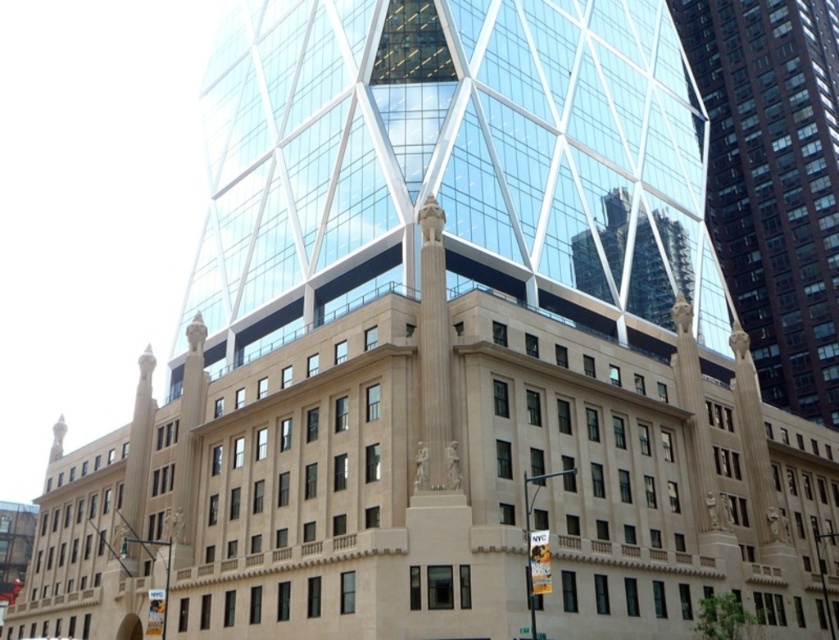
Looking at this image, you are a photographer trying to capture both the brown glass building at center and the metallic silver car at center in a single frame. Based on their sizes, which object should appear larger in your photo?

The brown glass building at center appears larger in the photo because it has a greater height compared to the metallic silver car at center.